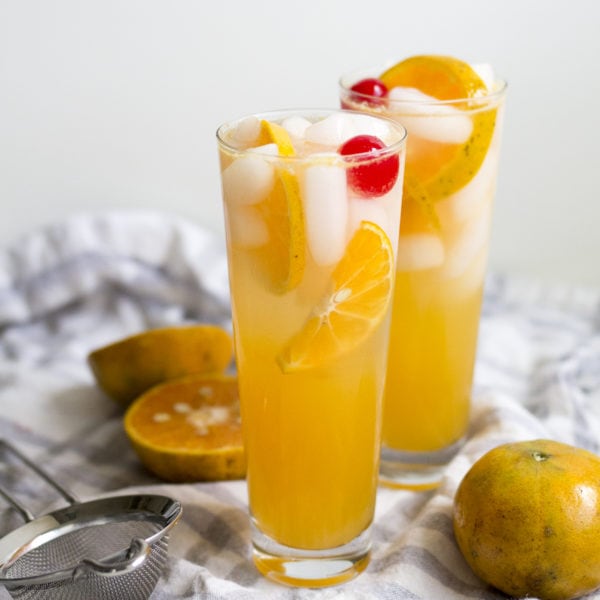
Locate an element on the screen. stainless steel rim of strainer is located at coordinates (87, 515).